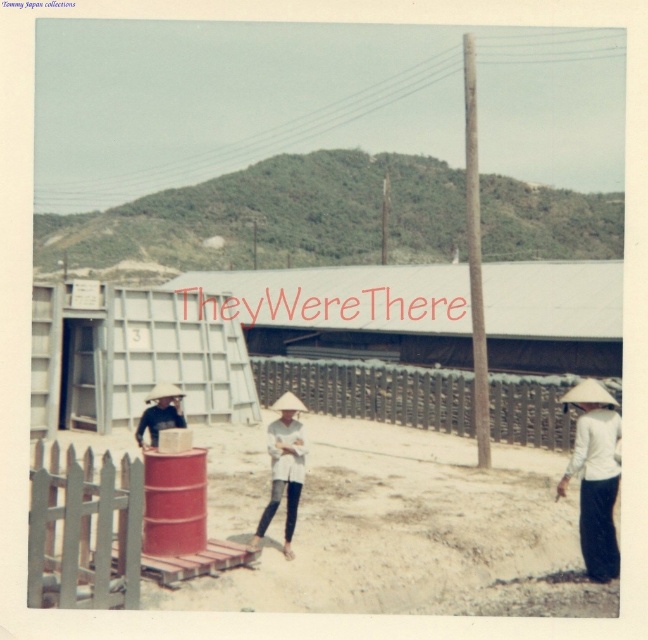
Can you confirm if brown sandy ground at center is thinner than white matte hat at center?

In fact, brown sandy ground at center might be wider than white matte hat at center.

Who is shorter, brown sandy ground at center or white matte hat at center?

brown sandy ground at center

At what (x,y) coordinates should I click in order to perform the action: click on brown sandy ground at center. Please return your answer as a coordinate pair (x, y). The width and height of the screenshot is (648, 640). Looking at the image, I should click on pos(413,532).

Is brown sandy ground at center to the left of white matte conical hat at lower right from the viewer's perspective?

Yes, brown sandy ground at center is to the left of white matte conical hat at lower right.

Can you confirm if brown sandy ground at center is positioned to the right of white matte conical hat at lower right?

Incorrect, brown sandy ground at center is not on the right side of white matte conical hat at lower right.

Who is more distant from viewer, (185, 605) or (575, 392)?

The point (575, 392) is more distant.

In order to click on brown sandy ground at center in this screenshot , I will do `click(413, 532)`.

Find the location of a particular element. white matte conical hat at lower right is located at coordinates (594, 476).

Who is lower down, white matte conical hat at lower right or white matte hat at center?

Positioned lower is white matte hat at center.

You are a GUI agent. You are given a task and a screenshot of the screen. Output one action in this format:
    pyautogui.click(x=<x>, y=<y>)
    Task: Click on the white matte conical hat at lower right
    Image resolution: width=648 pixels, height=640 pixels.
    Given the screenshot: What is the action you would take?
    pyautogui.click(x=594, y=476)

The image size is (648, 640). Find the location of `white matte conical hat at lower right`. white matte conical hat at lower right is located at coordinates (594, 476).